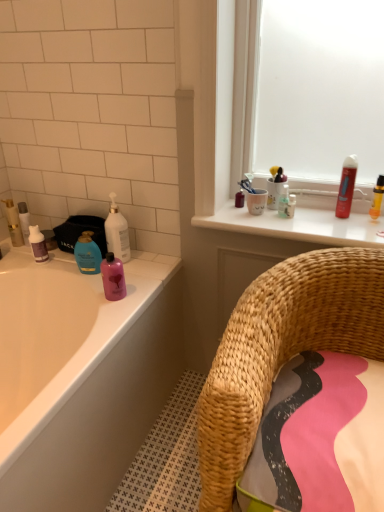
Question: Is translucent plastic toothbrush at upper center, the third toiletry from the right, far from blue glossy lotion at left, placed as the 3th toiletry when sorted from left to right?

Choices:
 (A) no
 (B) yes

Answer: (A)

Question: From the image's perspective, does translucent plastic toothbrush at upper center, which appears as the 4th toiletry when viewed from the left, appear lower than blue glossy lotion at left, which is counted as the 4th toiletry, starting from the right?

Choices:
 (A) yes
 (B) no

Answer: (B)

Question: Is translucent plastic toothbrush at upper center, the third toiletry from the right, taller than blue glossy lotion at left, which is counted as the 4th toiletry, starting from the right?

Choices:
 (A) no
 (B) yes

Answer: (A)

Question: Considering the relative positions of translucent plastic toothbrush at upper center, the third toiletry from the right, and blue glossy lotion at left, which is counted as the 4th toiletry, starting from the right, in the image provided, is translucent plastic toothbrush at upper center, the third toiletry from the right, to the right of blue glossy lotion at left, which is counted as the 4th toiletry, starting from the right, from the viewer's perspective?

Choices:
 (A) yes
 (B) no

Answer: (A)

Question: Could you tell me if translucent plastic toothbrush at upper center, the third toiletry from the right, is turned towards blue glossy lotion at left, placed as the 3th toiletry when sorted from left to right?

Choices:
 (A) yes
 (B) no

Answer: (B)

Question: Is translucent plastic toothbrush at upper center, the third toiletry from the right, positioned before blue glossy lotion at left, placed as the 3th toiletry when sorted from left to right?

Choices:
 (A) yes
 (B) no

Answer: (B)

Question: Is red glossy mouthwash at upper right, arranged as the 3th mouthwash when viewed from the left, looking in the opposite direction of matte white tube at left, marked as the 5th toiletry in a right-to-left arrangement?

Choices:
 (A) yes
 (B) no

Answer: (B)

Question: Does red glossy mouthwash at upper right, arranged as the 3th mouthwash when viewed from the left, appear on the left side of matte white tube at left, marked as the 5th toiletry in a right-to-left arrangement?

Choices:
 (A) no
 (B) yes

Answer: (A)

Question: Does red glossy mouthwash at upper right, the 3th mouthwash ordered from the bottom, have a lesser height compared to matte white tube at left, which is the 2th toiletry from left to right?

Choices:
 (A) yes
 (B) no

Answer: (B)

Question: Is red glossy mouthwash at upper right, the first mouthwash viewed from the right, positioned far away from matte white tube at left, marked as the 5th toiletry in a right-to-left arrangement?

Choices:
 (A) no
 (B) yes

Answer: (B)

Question: Is red glossy mouthwash at upper right, the 3th mouthwash ordered from the bottom, taller than matte white tube at left, marked as the 5th toiletry in a right-to-left arrangement?

Choices:
 (A) yes
 (B) no

Answer: (A)

Question: From the image's perspective, is red glossy mouthwash at upper right, the 3th mouthwash ordered from the bottom, located above matte white tube at left, which is the 2th toiletry from left to right?

Choices:
 (A) no
 (B) yes

Answer: (B)

Question: Is purple matte bottle at left, which ranks as the 1th mouthwash in left-to-right order, placed right next to pink glossy bottle at upper left, the first mouthwash from the bottom?

Choices:
 (A) no
 (B) yes

Answer: (A)